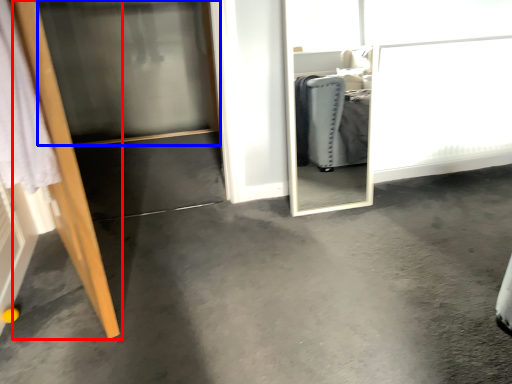
Question: Which object appears farthest to the camera in this image, door (highlighted by a red box) or screen door (highlighted by a blue box)?

Choices:
 (A) door
 (B) screen door

Answer: (B)